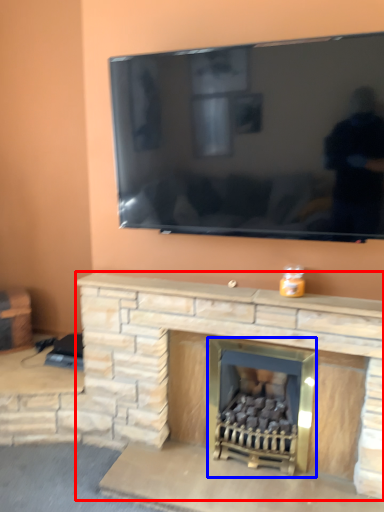
Question: Among these objects, which one is nearest to the camera, fireplace (highlighted by a red box) or fireplace (highlighted by a blue box)?

Choices:
 (A) fireplace
 (B) fireplace

Answer: (A)